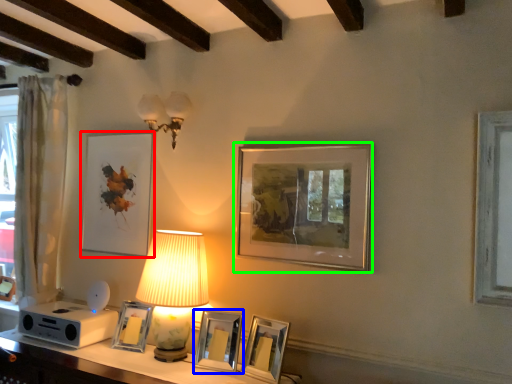
Question: Which object is positioned closest to picture frame (highlighted by a red box)? Select from picture frame (highlighted by a blue box) and picture frame (highlighted by a green box).

Choices:
 (A) picture frame
 (B) picture frame

Answer: (A)